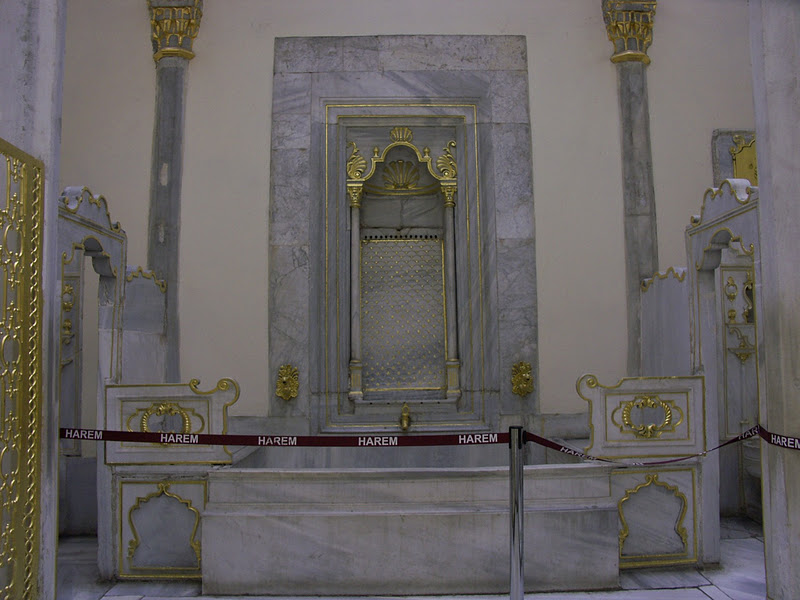
Find the location of a particular element. right marble pillar against wall is located at coordinates (642, 174).